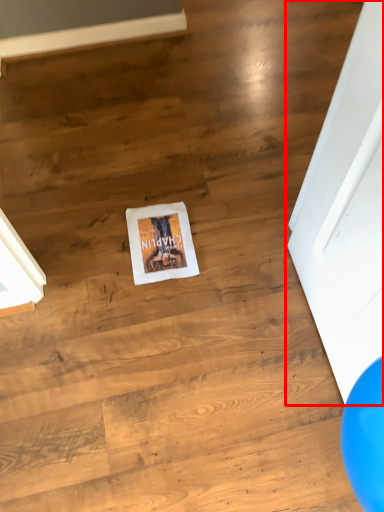
Question: From the image's perspective, considering the relative positions of door (annotated by the red box) and flyer in the image provided, where is door (annotated by the red box) located with respect to the staircase?

Choices:
 (A) below
 (B) above

Answer: (A)